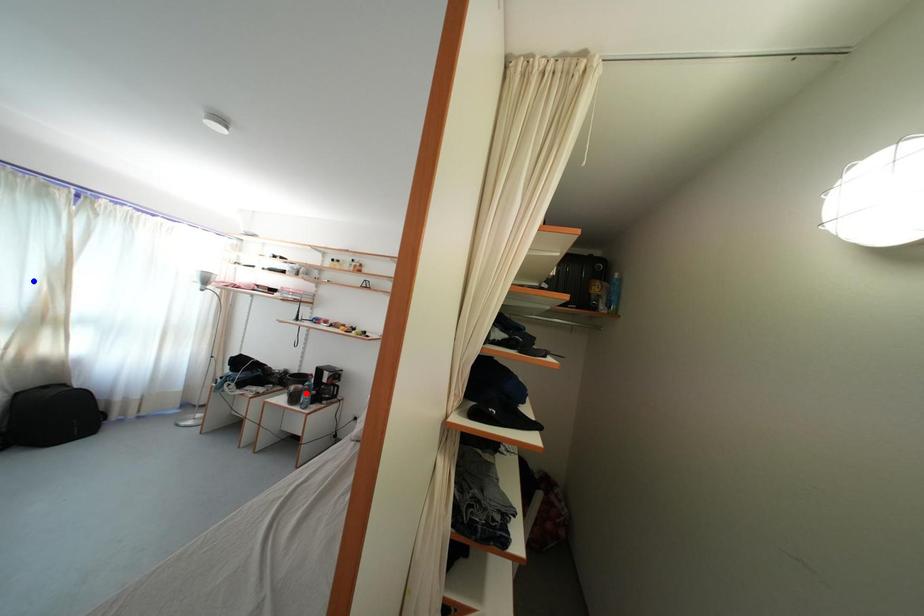
Question: Two points are marked on the image. Which point is closer to the camera?

Choices:
 (A) Blue point is closer.
 (B) Red point is closer.

Answer: (A)